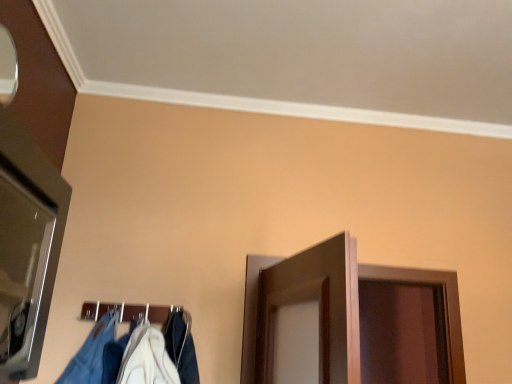
Where is `denim jeans at lower left`? denim jeans at lower left is located at coordinates (91, 353).

This screenshot has height=384, width=512. What do you see at coordinates (91, 353) in the screenshot?
I see `denim jeans at lower left` at bounding box center [91, 353].

Where is `denim jeans at lower left`? The image size is (512, 384). denim jeans at lower left is located at coordinates (91, 353).